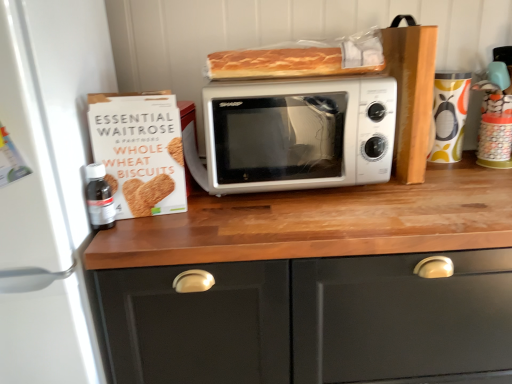
In order to click on free spot to the right of transparent plastic bottle at left in this screenshot , I will do `click(178, 226)`.